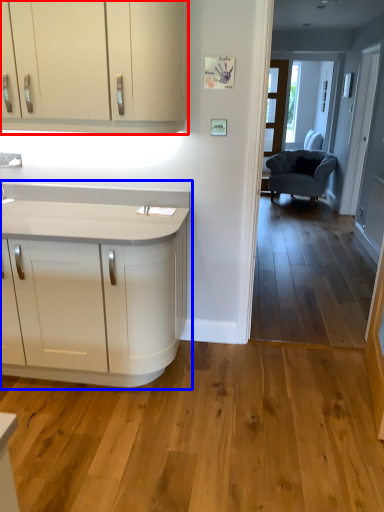
Question: Which object is closer to the camera taking this photo, cabinetry (highlighted by a red box) or countertop (highlighted by a blue box)?

Choices:
 (A) cabinetry
 (B) countertop

Answer: (A)